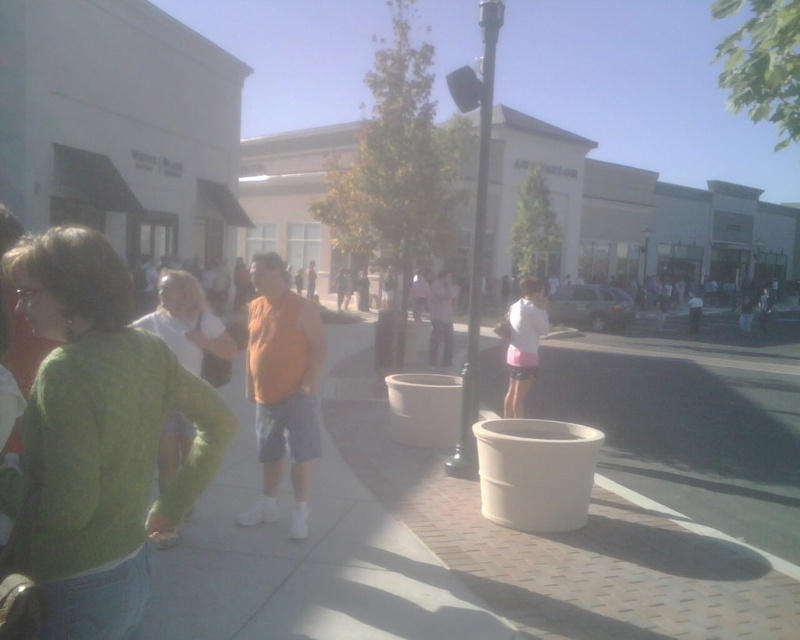
Question: Observing the image, what is the correct spatial positioning of green knitted sweater at center in reference to pink fabric shorts at center?

Choices:
 (A) below
 (B) above

Answer: (A)

Question: Among these points, which one is farthest from the camera?

Choices:
 (A) (533, 348)
 (B) (12, 262)

Answer: (A)

Question: Which of the following is the closest to the observer?

Choices:
 (A) green knitted sweater at center
 (B) pink fabric shorts at center

Answer: (A)

Question: Can you confirm if green knitted sweater at center is positioned above pink fabric shorts at center?

Choices:
 (A) yes
 (B) no

Answer: (B)

Question: Where is green knitted sweater at center located in relation to pink fabric shorts at center in the image?

Choices:
 (A) right
 (B) left

Answer: (B)